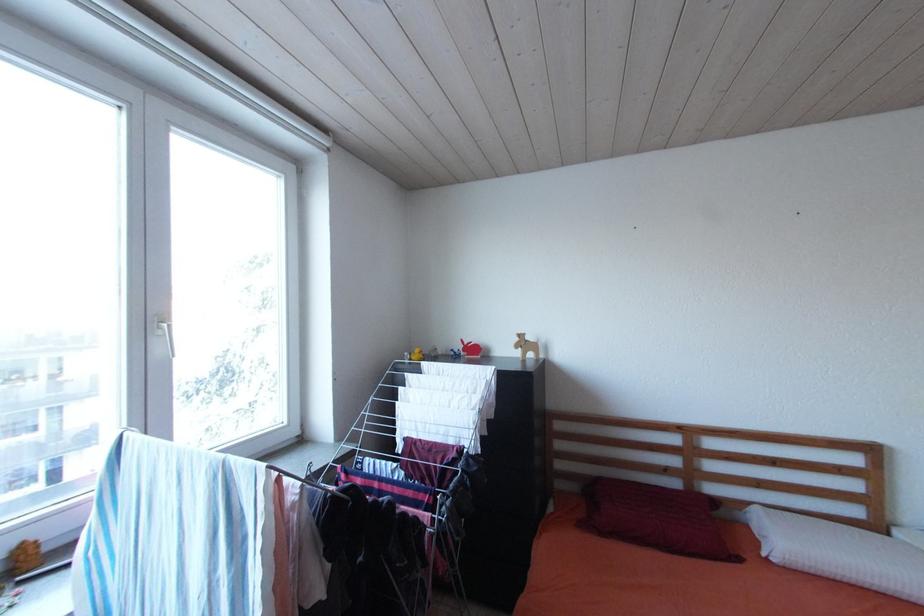
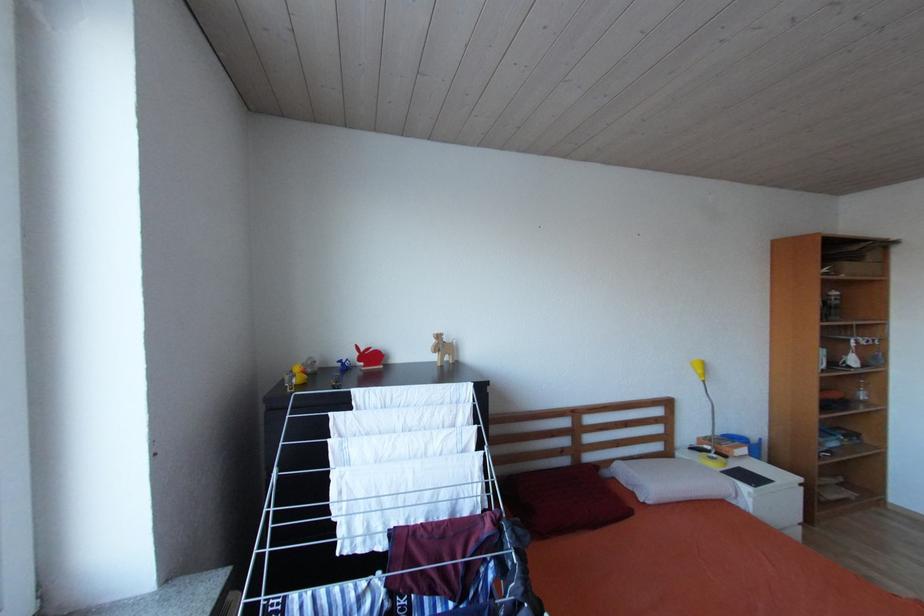
Question: The camera is either moving clockwise (left) or counter-clockwise (right) around the object. The first image is from the beginning of the video and the second image is from the end. Is the camera moving left or right when shooting the video?

Choices:
 (A) Left
 (B) Right

Answer: (A)